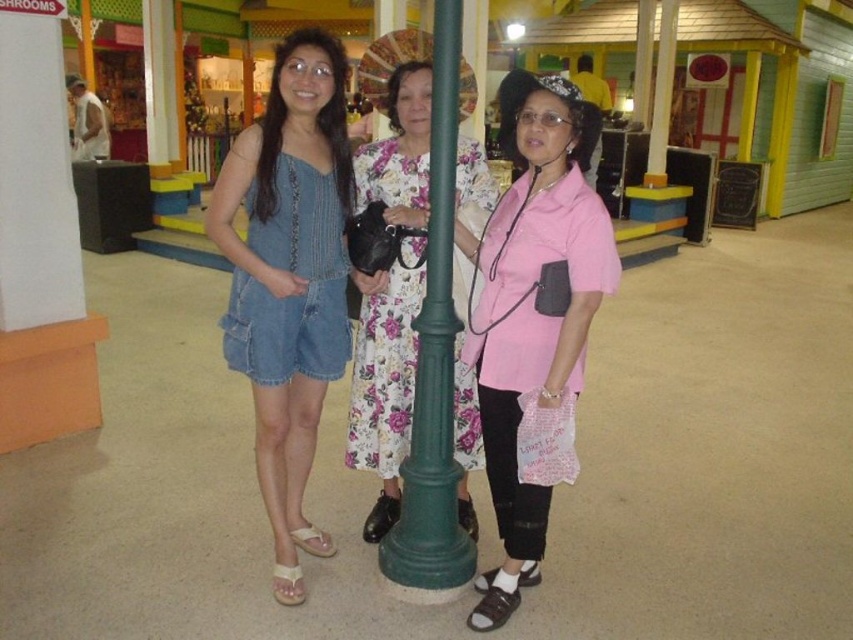
You are organizing a photo shoot and need to arrange the pink matte shirt at center and the floral fabric dress at center in a specific order. According to the scene, which one is located to the right of the other?

The pink matte shirt at center is positioned on the right side of the floral fabric dress at center, so the pink matte shirt at center is to the right of the floral fabric dress at center.

You are standing at point (277, 408) and want to walk to point (511, 493). Is the destination point behind you or in front of you?

The destination point (511, 493) is behind point (277, 408) according to the spatial description, so it would be behind you if you are standing at (277, 408).